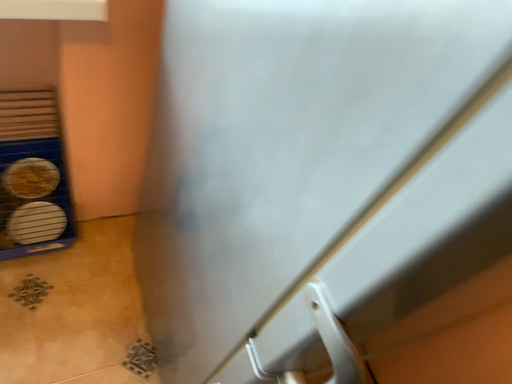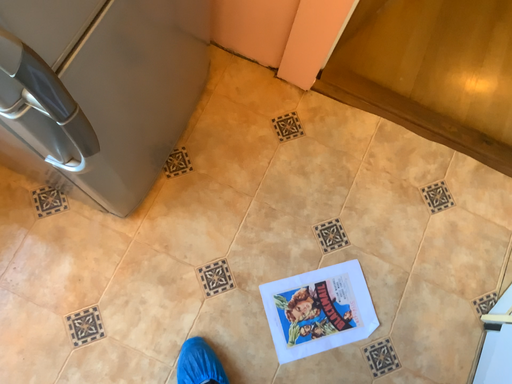
Question: How did the camera likely rotate when shooting the video?

Choices:
 (A) rotated left
 (B) rotated right

Answer: (B)